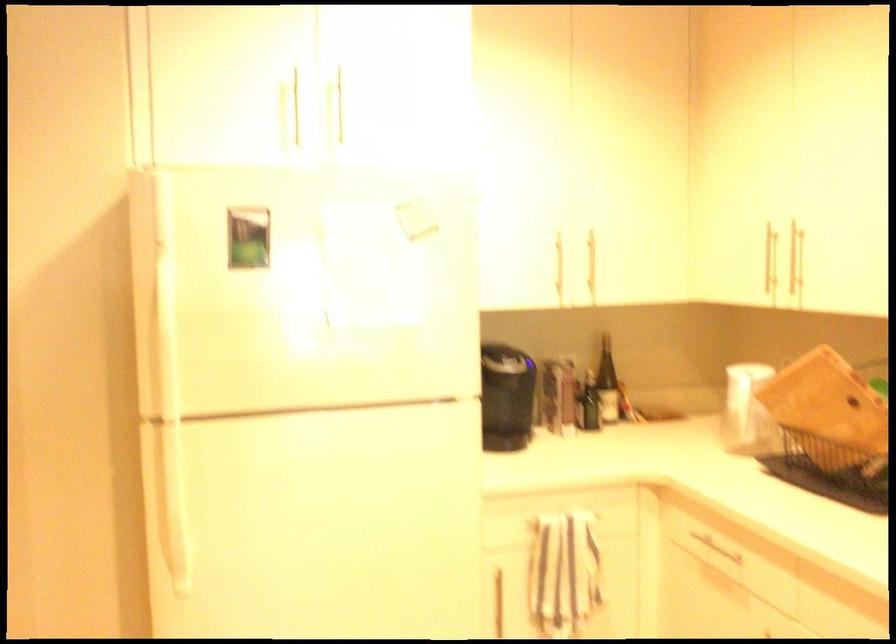
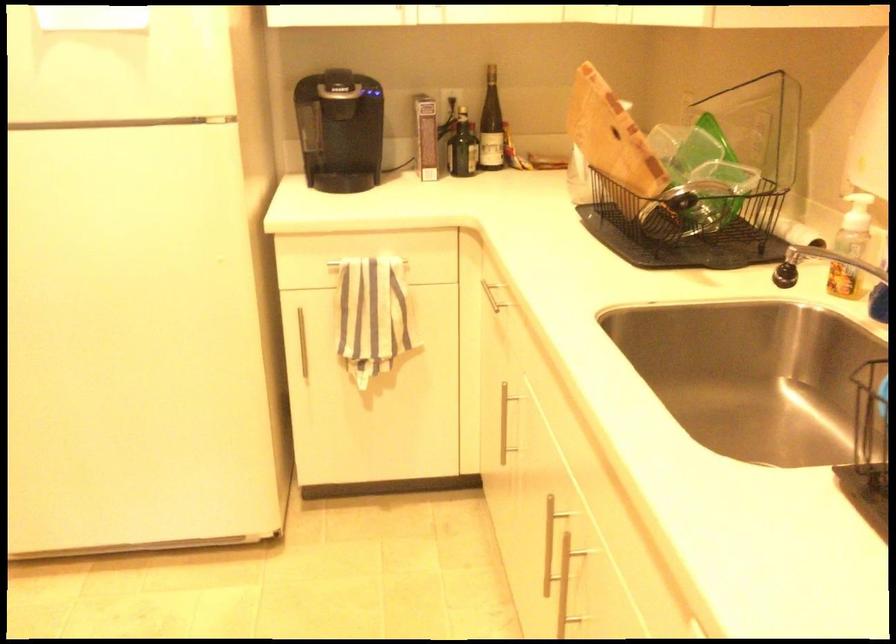
Question: The first image is from the beginning of the video and the second image is from the end. How did the camera likely rotate when shooting the video?

Choices:
 (A) Left
 (B) Right
 (C) Up
 (D) Down

Answer: (D)